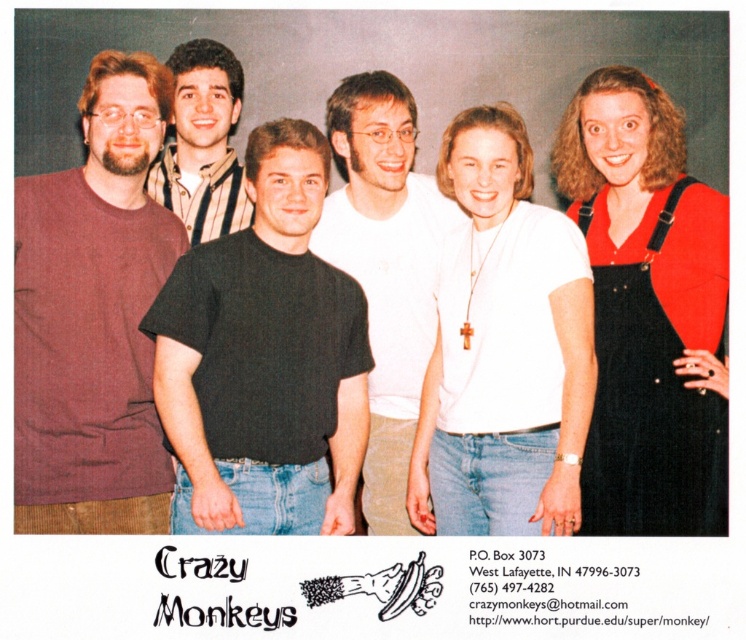
Question: Which is farther from the white matte shirt at center?

Choices:
 (A) maroon t-shirt at left
 (B) black cotton t-shirt at center

Answer: (A)

Question: Among these objects, which one is nearest to the camera?

Choices:
 (A) black cotton t-shirt at center
 (B) white matte t-shirt at center

Answer: (A)

Question: Among these points, which one is farthest from the camera?

Choices:
 (A) (251, 385)
 (B) (90, 412)
 (C) (192, 76)

Answer: (C)

Question: Can you confirm if maroon t-shirt at left is thinner than black corduroy overalls at right?

Choices:
 (A) yes
 (B) no

Answer: (A)

Question: Can you confirm if white matte t-shirt at center is positioned above striped shirt at center?

Choices:
 (A) yes
 (B) no

Answer: (B)

Question: Observing the image, what is the correct spatial positioning of maroon t-shirt at left in reference to white matte t-shirt at center?

Choices:
 (A) above
 (B) below

Answer: (A)